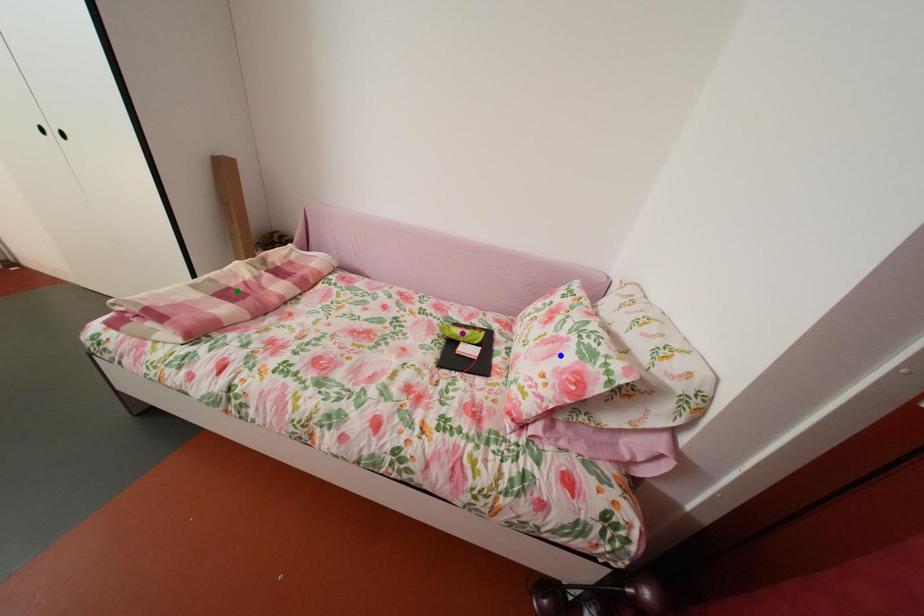
Order these from farthest to nearest:
- blue point
- purple point
- green point

1. purple point
2. green point
3. blue point